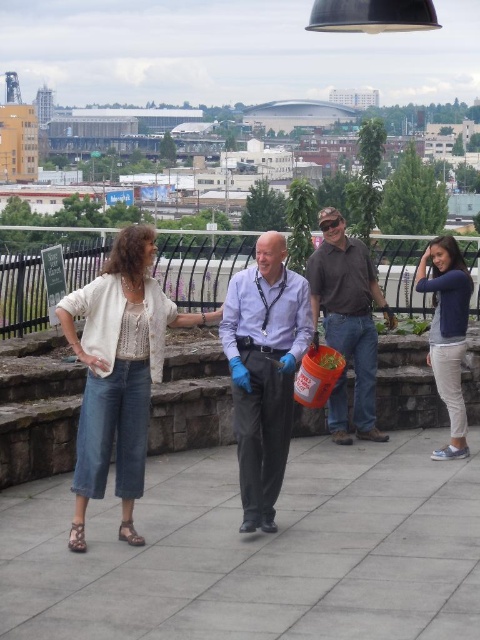
Question: Which is farther from the denim pants at center?

Choices:
 (A) light blue denim jeans at right
 (B) brown cotton shirt at center

Answer: (A)

Question: Does denim pants at center have a lesser width compared to matte blue shirt at center?

Choices:
 (A) no
 (B) yes

Answer: (A)

Question: Which of the following is the closest to the observer?

Choices:
 (A) (443, 392)
 (B) (367, 387)

Answer: (A)

Question: Does matte blue shirt at center have a lesser width compared to brown cotton shirt at center?

Choices:
 (A) no
 (B) yes

Answer: (B)

Question: Which point is closer to the camera taking this photo?

Choices:
 (A) (80, 307)
 (B) (343, 300)
 (C) (287, 433)

Answer: (A)

Question: Is matte blue shirt at center thinner than light blue denim jeans at right?

Choices:
 (A) no
 (B) yes

Answer: (A)